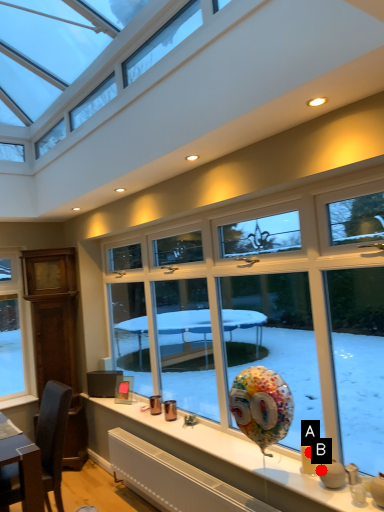
Question: Two points are circled on the image, labeled by A and B beside each circle. Which point is closer to the camera taking this photo?

Choices:
 (A) A is closer
 (B) B is closer

Answer: (B)